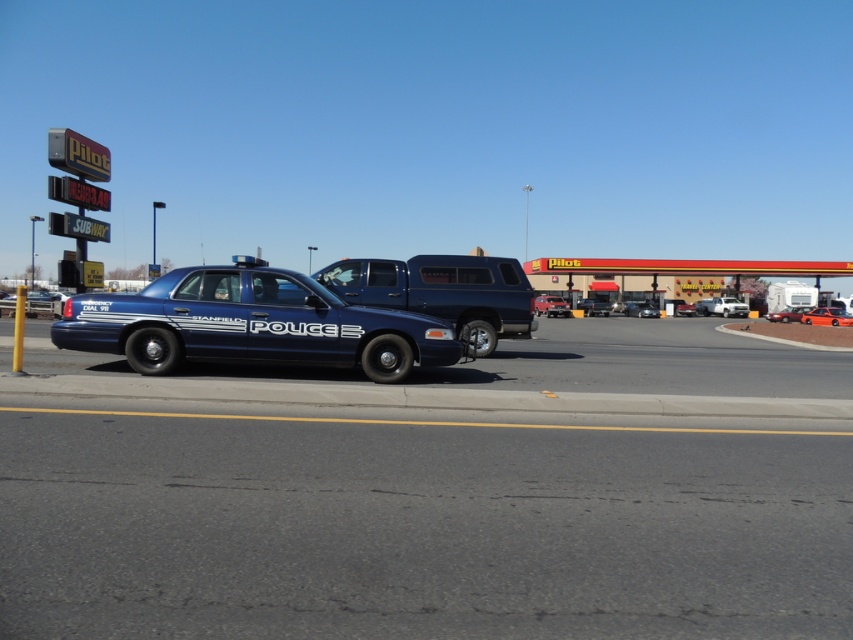
You are a driver who wants to know which vehicle is taller between the glossy blue police car at center and the glossy blue pickup truck at center. Based on the scene, which one is taller?

The glossy blue pickup truck at center is taller than the glossy blue police car at center.

You are a delivery driver needing to exit the parking lot. You see an orange matte sedan at center and a metallic blue sedan at center. Which vehicle should you move around to exit without passing through the other?

The orange matte sedan at center is in front of the metallic blue sedan at center, so you should move around the orange matte sedan at center to exit since it is blocking the path to the metallic blue sedan at center.